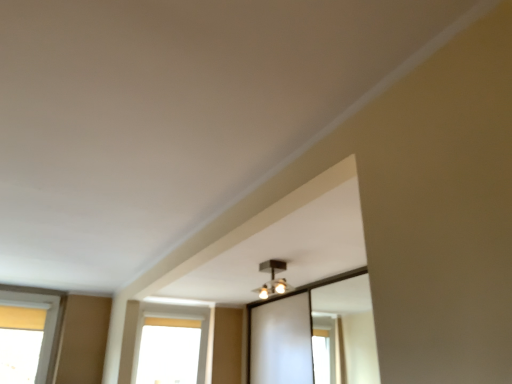
What are the coordinates of `matte black light fixture at upper center` in the screenshot? It's located at (273, 279).

Describe the element at coordinates (273, 279) in the screenshot. The image size is (512, 384). I see `matte black light fixture at upper center` at that location.

This screenshot has width=512, height=384. I want to click on transparent glass window at lower center, so click(170, 345).

Image resolution: width=512 pixels, height=384 pixels. Describe the element at coordinates (170, 345) in the screenshot. I see `transparent glass window at lower center` at that location.

At what (x,y) coordinates should I click in order to perform the action: click on matte black light fixture at upper center. Please return your answer as a coordinate pair (x, y). Image resolution: width=512 pixels, height=384 pixels. Looking at the image, I should click on (273, 279).

Visually, is matte black light fixture at upper center positioned to the left or to the right of transparent glass window at lower center?

Clearly, matte black light fixture at upper center is on the right of transparent glass window at lower center in the image.

Is the position of matte black light fixture at upper center less distant than that of transparent glass window at lower center?

Yes, matte black light fixture at upper center is closer to the viewer.

Which is closer to the camera, (x=281, y=279) or (x=189, y=364)?

Point (x=281, y=279) appears to be closer to the viewer than point (x=189, y=364).

From the image's perspective, which one is positioned lower, matte black light fixture at upper center or transparent glass window at lower center?

From the image's view, transparent glass window at lower center is below.

Based on the photo, from a real-world perspective, who is located lower, matte black light fixture at upper center or transparent glass window at lower center?

In real-world perspective, transparent glass window at lower center is lower.

Which of these two, matte black light fixture at upper center or transparent glass window at lower center, is thinner?

transparent glass window at lower center is thinner.

Considering the sizes of objects matte black light fixture at upper center and transparent glass window at lower center in the image provided, who is taller, matte black light fixture at upper center or transparent glass window at lower center?

Standing taller between the two is transparent glass window at lower center.

Can you confirm if matte black light fixture at upper center is bigger than transparent glass window at lower center?

No.

Is matte black light fixture at upper center outside of transparent glass window at lower center?

Yes, matte black light fixture at upper center is not within transparent glass window at lower center.

Is matte black light fixture at upper center beside transparent glass window at lower center?

No.

Is matte black light fixture at upper center looking in the opposite direction of transparent glass window at lower center?

Yes.

How many degrees apart are the facing directions of matte black light fixture at upper center and transparent glass window at lower center?

1.01 degrees.

In order to click on light fixture above the transparent glass window at lower center (from a real-world perspective) in this screenshot , I will do 273,279.

Consider the image. Is transparent glass window at lower center to the left or to the right of matte black light fixture at upper center in the image?

transparent glass window at lower center is to the left of matte black light fixture at upper center.

In the image, is transparent glass window at lower center positioned in front of or behind matte black light fixture at upper center?

transparent glass window at lower center is positioned farther from the viewer than matte black light fixture at upper center.

Does point (136, 373) come behind point (282, 290)?

Yes, point (136, 373) is farther from viewer.

From the image's perspective, between transparent glass window at lower center and matte black light fixture at upper center, which one is located above?

From the image's view, matte black light fixture at upper center is above.

From a real-world perspective, is transparent glass window at lower center located beneath matte black light fixture at upper center?

Indeed, from a real-world perspective, transparent glass window at lower center is positioned beneath matte black light fixture at upper center.

Considering the relative sizes of transparent glass window at lower center and matte black light fixture at upper center in the image provided, is transparent glass window at lower center thinner than matte black light fixture at upper center?

Correct, the width of transparent glass window at lower center is less than that of matte black light fixture at upper center.

Which of these two, transparent glass window at lower center or matte black light fixture at upper center, stands shorter?

With less height is matte black light fixture at upper center.

Based on their sizes in the image, would you say transparent glass window at lower center is bigger or smaller than matte black light fixture at upper center?

Considering their sizes, transparent glass window at lower center takes up more space than matte black light fixture at upper center.

Is matte black light fixture at upper center completely or partially inside transparent glass window at lower center?

That's incorrect, matte black light fixture at upper center is not inside transparent glass window at lower center.

Are transparent glass window at lower center and matte black light fixture at upper center far apart?

That's not correct — transparent glass window at lower center is a little close to matte black light fixture at upper center.

Is transparent glass window at lower center aimed at matte black light fixture at upper center?

Yes, transparent glass window at lower center is facing matte black light fixture at upper center.

Image resolution: width=512 pixels, height=384 pixels. Find the location of `light fixture on the right of the transparent glass window at lower center`. light fixture on the right of the transparent glass window at lower center is located at coordinates [x=273, y=279].

Locate an element on the screen. The height and width of the screenshot is (384, 512). window that appears behind the matte black light fixture at upper center is located at coordinates (170, 345).

Find the location of a particular element. light fixture above the transparent glass window at lower center (from the image's perspective) is located at coordinates (273, 279).